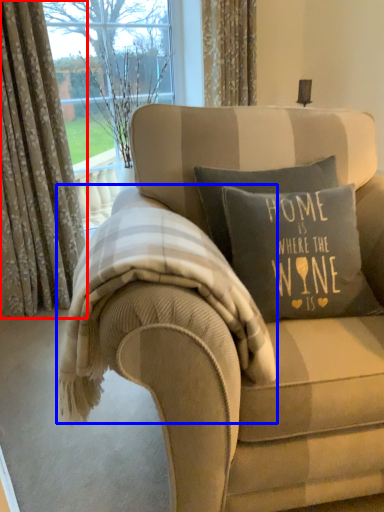
Question: Which object is closer to the camera taking this photo, curtain (highlighted by a red box) or bedding (highlighted by a blue box)?

Choices:
 (A) curtain
 (B) bedding

Answer: (B)